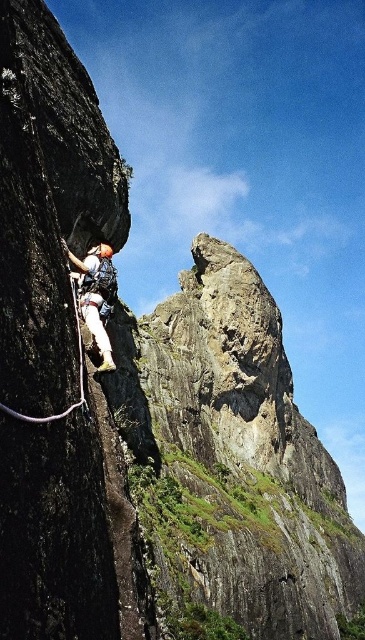
Does white climbing harness at left appear over white nylon rope at left?

Indeed, white climbing harness at left is positioned over white nylon rope at left.

Based on the photo, is white climbing harness at left to the left of white nylon rope at left from the viewer's perspective?

Indeed, white climbing harness at left is positioned on the left side of white nylon rope at left.

Image resolution: width=365 pixels, height=640 pixels. What do you see at coordinates (95, 294) in the screenshot? I see `white climbing harness at left` at bounding box center [95, 294].

You are a GUI agent. You are given a task and a screenshot of the screen. Output one action in this format:
    pyautogui.click(x=<x>, y=<y>)
    Task: Click on the white climbing harness at left
    
    Given the screenshot: What is the action you would take?
    pyautogui.click(x=95, y=294)